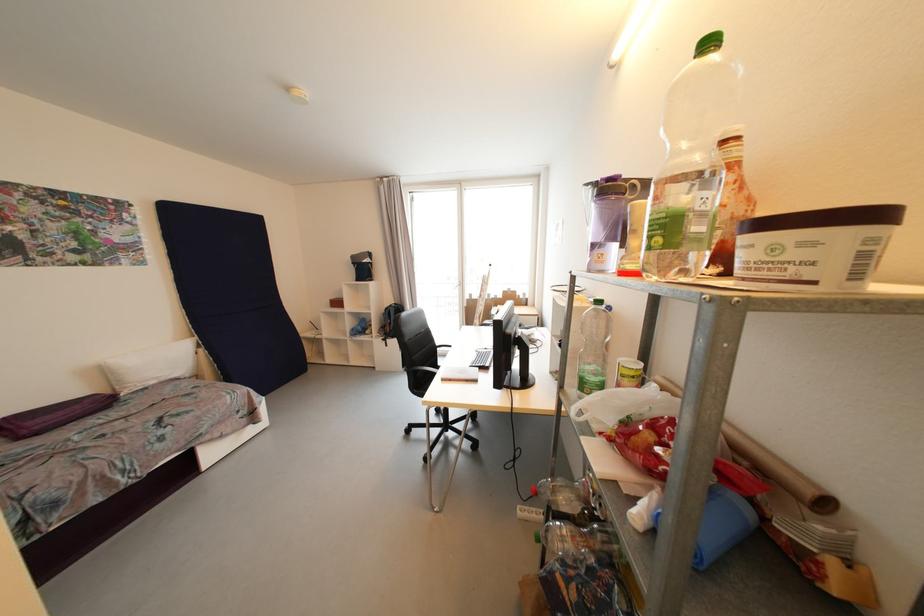
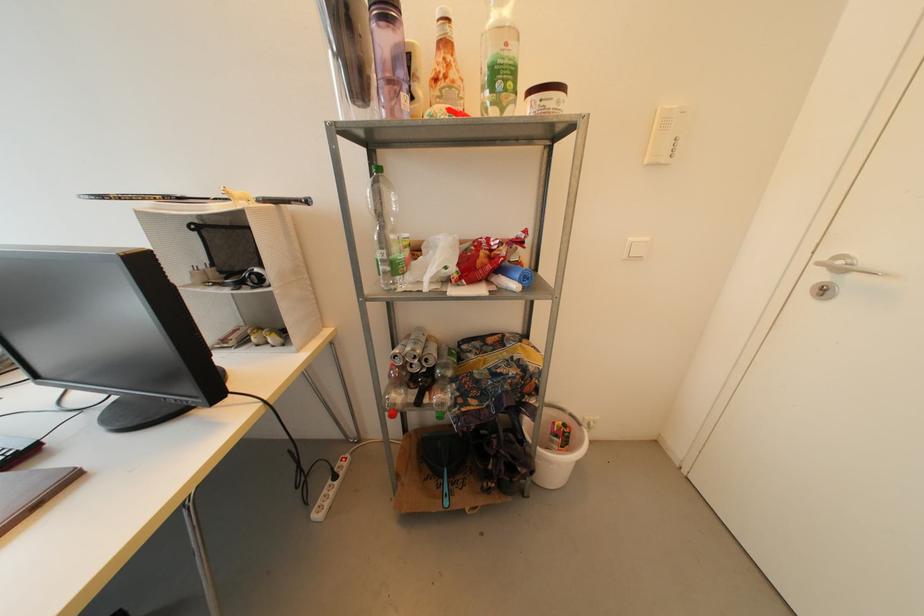
The images are taken continuously from a first-person perspective. In which direction is your viewpoint rotating?

The camera rotated toward right-down.